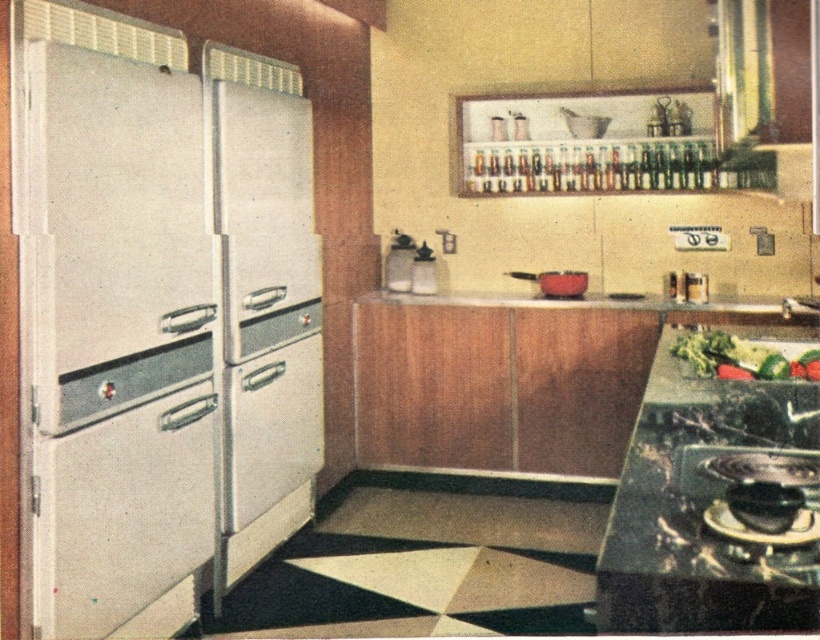
You are organizing a kitchen layout and need to place a new appliance next to the metallic gray refrigerator at left. The appliance requires a space wider than the refrigerator. Can the space where the red matte pot at center is currently placed accommodate this appliance?

The metallic gray refrigerator at left is narrower than the red matte pot at center. Since the red matte pot at center occupies a space wider than the refrigerator, the appliance requiring a wider space than the refrigerator can be placed there.

Looking at this image, you are organizing a kitchen layout and need to place a new spice rack between the metallic gray refrigerator at left and the red matte pot at center. Based on their positions, which object should the spice rack be closer to?

The spice rack should be placed closer to the red matte pot at center because the metallic gray refrigerator at left is positioned on the left side of the red matte pot at center, meaning the pot is further to the right, leaving more space between them where the spice rack can be placed near the pot.

Based on the photo, you are a chef preparing a dish and need to place a red matte pot at center on the smooth white countertop at center. Considering the space between them, will the pot fit comfortably on the countertop?

The smooth white countertop at center is 10.45 inches from the red matte pot at center. Since the distance between them is sufficient, the pot will fit comfortably on the countertop.